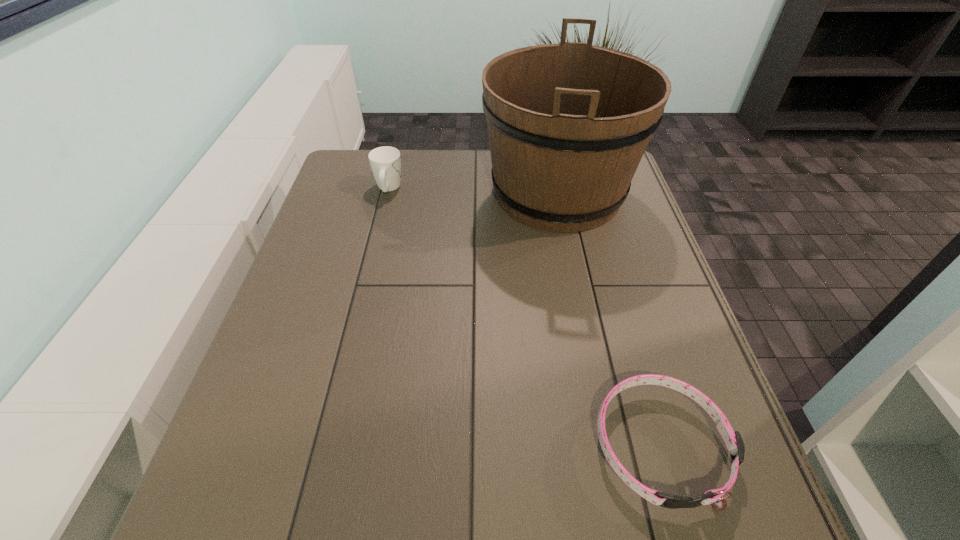
Find the location of a particular element. vacant area at the left edge of the desktop is located at coordinates (336, 242).

Image resolution: width=960 pixels, height=540 pixels. In order to click on vacant space at the right edge in this screenshot , I will do `click(631, 205)`.

Locate an element on the screen. unoccupied area between the dog collar and the tallest object is located at coordinates (609, 319).

Locate an element on the screen. free space between the tallest object and the nearest object is located at coordinates (609, 319).

The height and width of the screenshot is (540, 960). Identify the location of free space between the second shortest object and the shortest object. (524, 317).

You are a GUI agent. You are given a task and a screenshot of the screen. Output one action in this format:
    pyautogui.click(x=<x>, y=<y>)
    Task: Click on the free space that is in between the leftmost object and the tallest object
    The image size is (960, 540).
    Given the screenshot: What is the action you would take?
    pyautogui.click(x=473, y=191)

This screenshot has height=540, width=960. In order to click on vacant space in between the tallest object and the second tallest object in this screenshot , I will do `click(473, 191)`.

Identify the location of vacant space that is in between the mug and the tallest object. Image resolution: width=960 pixels, height=540 pixels. (473, 191).

What are the coordinates of `free space between the second tallest object and the bucket` in the screenshot? It's located at (473, 191).

Where is `empty space between the mug and the bucket`? empty space between the mug and the bucket is located at coordinates (473, 191).